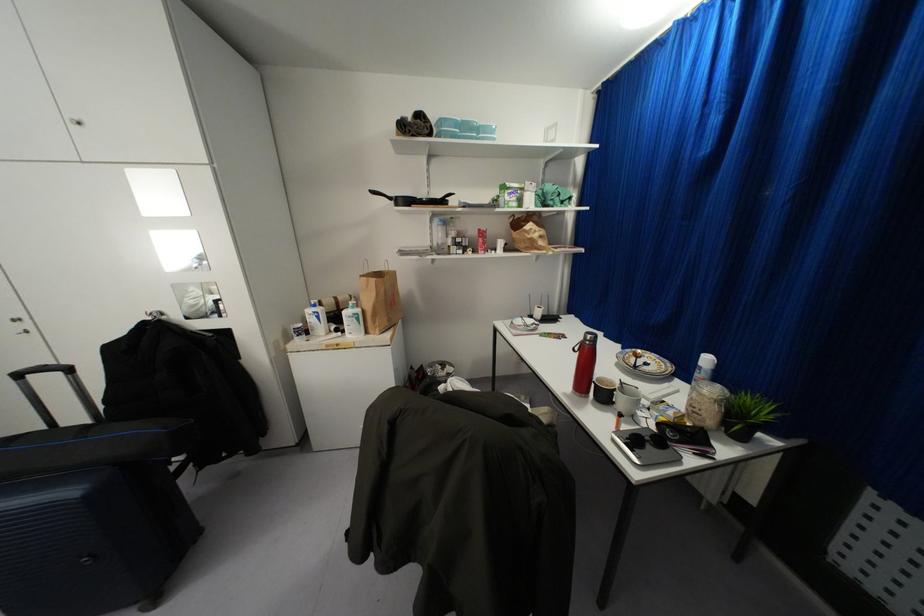
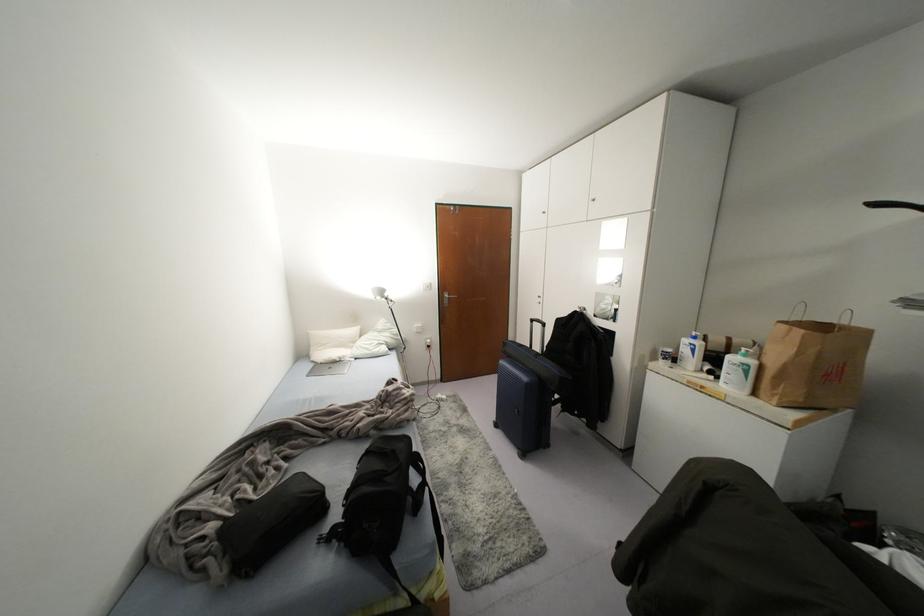
Where in the second image is the point corresponding to (x=317, y=315) from the first image?

(691, 350)